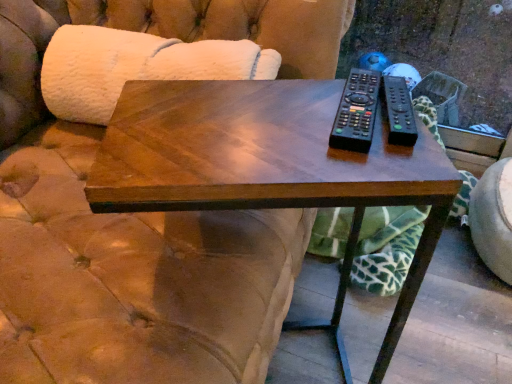
This screenshot has width=512, height=384. I want to click on vacant region to the left of black plastic remote at upper right, the 1th remote from the left, so click(x=243, y=119).